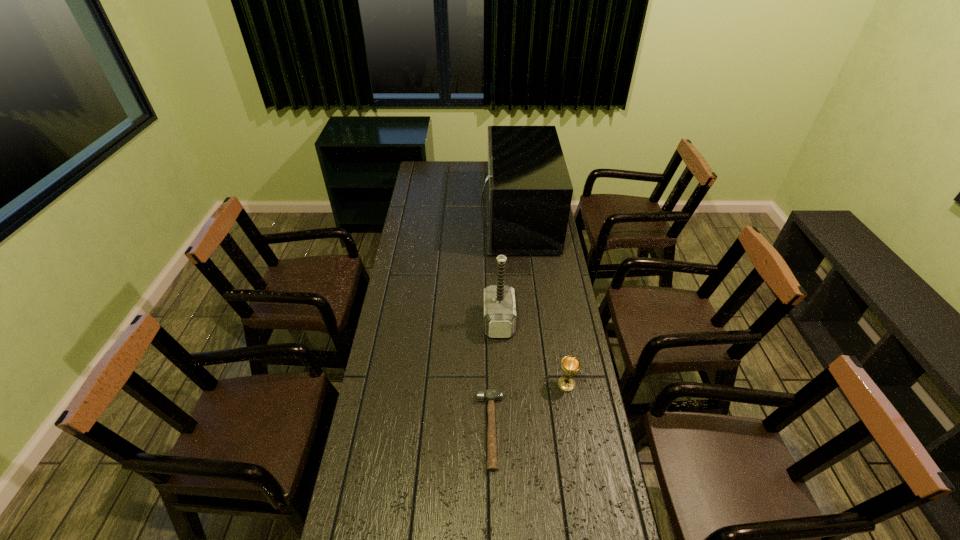
Find the location of a particular element. This screenshot has height=540, width=960. vacant space that's between the chalice and the farther hammer is located at coordinates (533, 353).

Identify the location of object that ranks as the third closest to the nearer hammer. The image size is (960, 540). (528, 188).

Find the location of a particular element. The height and width of the screenshot is (540, 960). object that stands as the third closest to the shortest object is located at coordinates (528, 188).

Where is `free space that satisfies the following two spatial constraints: 1. with the door open on the farthest object; 2. on the back side of the third tallest object`? free space that satisfies the following two spatial constraints: 1. with the door open on the farthest object; 2. on the back side of the third tallest object is located at coordinates (535, 384).

Find the location of a particular element. The height and width of the screenshot is (540, 960). vacant space that satisfies the following two spatial constraints: 1. with the door open on the farthest object; 2. on the right side of the chalice is located at coordinates (535, 384).

Where is `vacant space that satisfies the following two spatial constraints: 1. for striking with the head of the chalice; 2. on the right side of the farther hammer`? The image size is (960, 540). vacant space that satisfies the following two spatial constraints: 1. for striking with the head of the chalice; 2. on the right side of the farther hammer is located at coordinates (501, 384).

Find the location of `free location that satisfies the following two spatial constraints: 1. on the front side of the second shortest object; 2. on the striking face of the shorter hammer`. free location that satisfies the following two spatial constraints: 1. on the front side of the second shortest object; 2. on the striking face of the shorter hammer is located at coordinates (574, 430).

Find the location of `vacant space that satisfies the following two spatial constraints: 1. for striking with the head of the chalice; 2. on the right side of the taller hammer`. vacant space that satisfies the following two spatial constraints: 1. for striking with the head of the chalice; 2. on the right side of the taller hammer is located at coordinates (501, 384).

Find the location of a particular element. free space that satisfies the following two spatial constraints: 1. for striking with the head of the taller hammer; 2. on the right side of the second shortest object is located at coordinates (501, 384).

Locate an element on the screen. vacant position in the image that satisfies the following two spatial constraints: 1. for striking with the head of the third tallest object; 2. on the right side of the taller hammer is located at coordinates (501, 384).